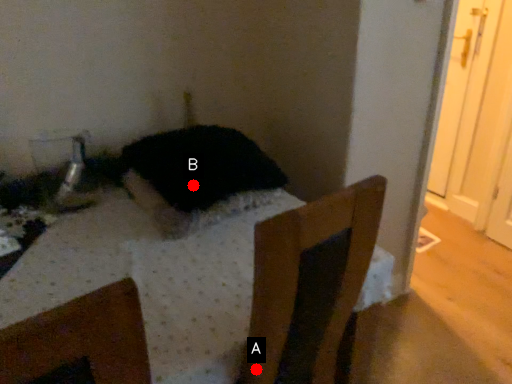
Question: Two points are circled on the image, labeled by A and B beside each circle. Which point is closer to the camera?

Choices:
 (A) A is closer
 (B) B is closer

Answer: (A)